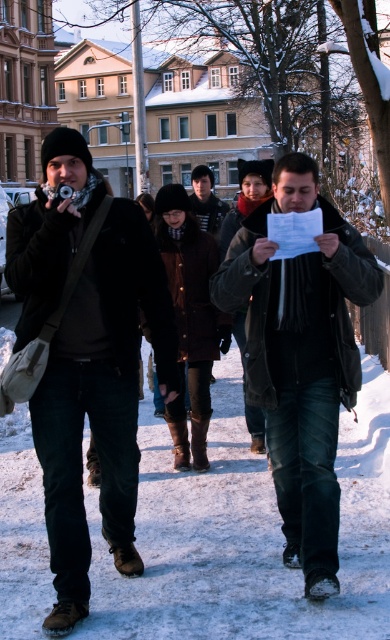
You are a photographer trying to capture both the matte black jacket at left and the dark brown leather jacket at center in a single frame. Which jacket should you focus on first to ensure both are in the frame?

You should focus on the dark brown leather jacket at center first because it is larger than the matte black jacket at left, ensuring it fits properly in the frame.

You are standing on the path and want to step onto the white snow at lower center. Is the dark gray leather jacket at center in your way?

The white snow at lower center is closer to you than the dark gray leather jacket at center, so the jacket is not blocking your path. You can step onto the white snow at lower center without any obstruction.